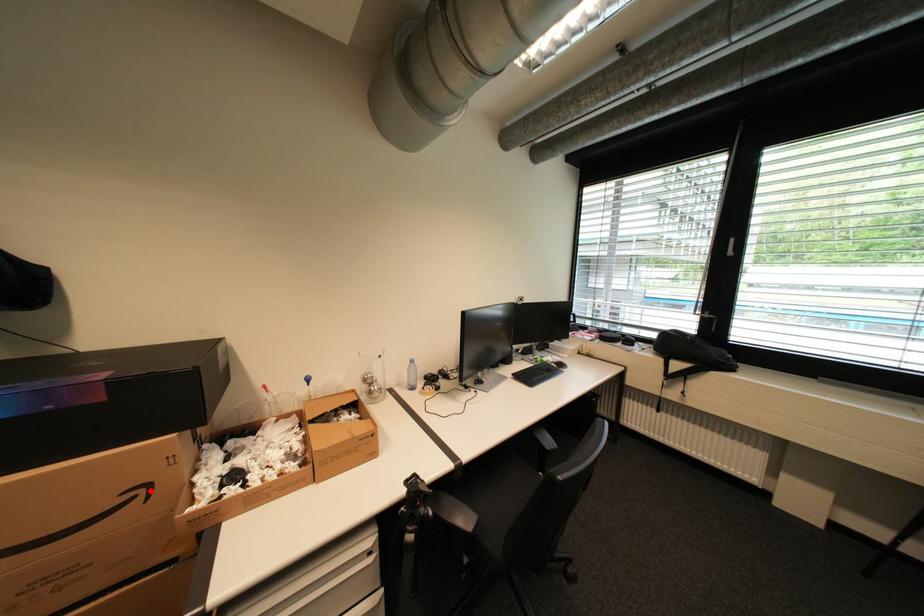
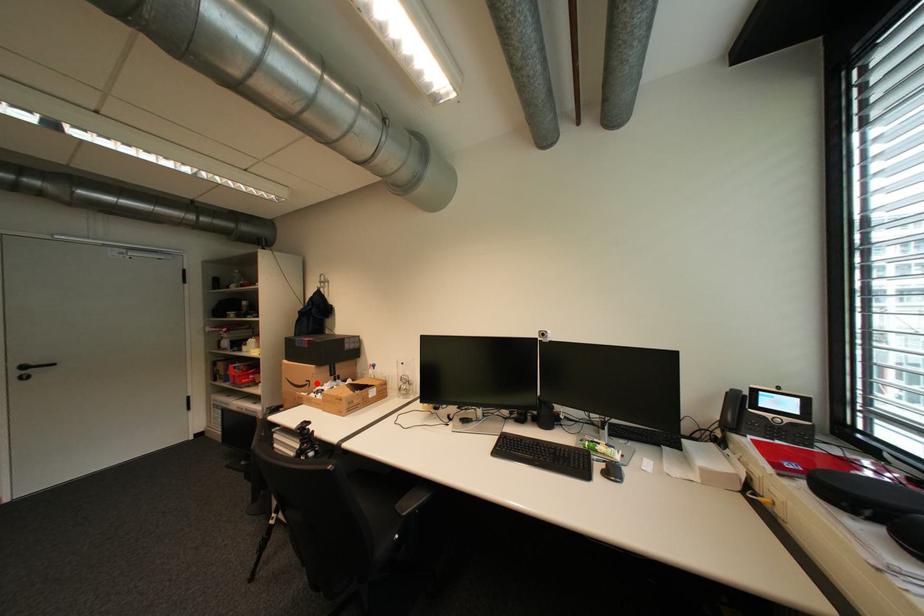
I am providing you with two images of the same scene from different viewpoints. A red point is marked on the first image and another point is marked on the second image. Is the marked point in image1 the same physical position as the marked point in image2?

Yes